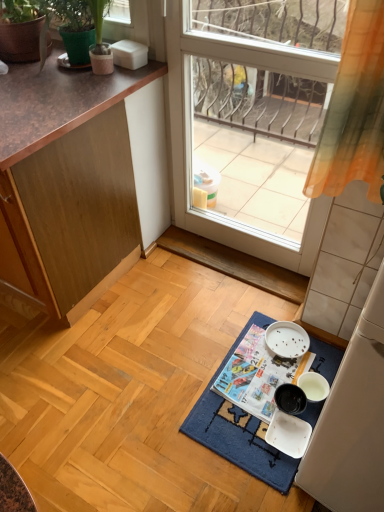
Question: Is white plastic bowl at lower right touching printed paper magazine at center?

Choices:
 (A) no
 (B) yes

Answer: (A)

Question: Does white plastic bowl at lower right lie behind printed paper magazine at center?

Choices:
 (A) no
 (B) yes

Answer: (A)

Question: From a real-world perspective, is white plastic bowl at lower right located higher than printed paper magazine at center?

Choices:
 (A) no
 (B) yes

Answer: (A)

Question: Considering the relative sizes of white plastic bowl at lower right and printed paper magazine at center in the image provided, is white plastic bowl at lower right wider than printed paper magazine at center?

Choices:
 (A) yes
 (B) no

Answer: (B)

Question: Is printed paper magazine at center inside white plastic bowl at lower right?

Choices:
 (A) yes
 (B) no

Answer: (B)

Question: Considering the relative positions of white plastic bowl at lower right and printed paper magazine at center in the image provided, is white plastic bowl at lower right to the left of printed paper magazine at center from the viewer's perspective?

Choices:
 (A) no
 (B) yes

Answer: (A)

Question: Can you confirm if wooden cabinet at left is wider than printed paper magazine at center?

Choices:
 (A) no
 (B) yes

Answer: (B)

Question: Considering the relative sizes of wooden cabinet at left and printed paper magazine at center in the image provided, is wooden cabinet at left shorter than printed paper magazine at center?

Choices:
 (A) yes
 (B) no

Answer: (B)

Question: Is wooden cabinet at left oriented towards printed paper magazine at center?

Choices:
 (A) yes
 (B) no

Answer: (B)

Question: From a real-world perspective, is wooden cabinet at left positioned over printed paper magazine at center based on gravity?

Choices:
 (A) no
 (B) yes

Answer: (B)

Question: From the image's perspective, does wooden cabinet at left appear higher than printed paper magazine at center?

Choices:
 (A) yes
 (B) no

Answer: (A)

Question: Is wooden cabinet at left positioned beyond the bounds of printed paper magazine at center?

Choices:
 (A) no
 (B) yes

Answer: (B)

Question: Can you confirm if green textured pot at upper left is wider than printed paper magazine at center?

Choices:
 (A) no
 (B) yes

Answer: (A)